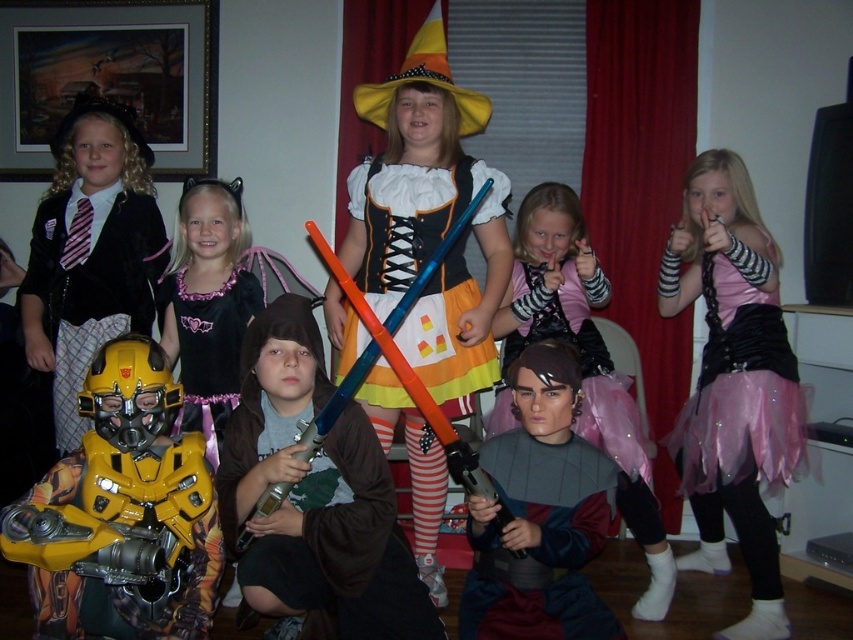
Question: Considering the real-world distances, which object is closest to the orange and yellow striped stockings at center?

Choices:
 (A) pink satin tutu at center
 (B) pink tulle skirt at right
 (C) metallic silver armor at center

Answer: (A)

Question: Which is farther from the pink tulle skirt at right?

Choices:
 (A) orange and yellow striped stockings at center
 (B) velvet black dress at upper left
 (C) orange satin dress at center

Answer: (B)

Question: Which is farther from the pink satin tutu at center?

Choices:
 (A) orange and yellow striped stockings at center
 (B) pink tulle skirt at right
 (C) metallic silver armor at center

Answer: (C)

Question: Does pink tulle skirt at right appear under metallic silver armor at center?

Choices:
 (A) no
 (B) yes

Answer: (A)

Question: Does velvet black dress at upper left appear on the right side of pink satin tutu at center?

Choices:
 (A) yes
 (B) no

Answer: (B)

Question: Does pink tulle skirt at right appear over velvet black dress at upper left?

Choices:
 (A) yes
 (B) no

Answer: (B)